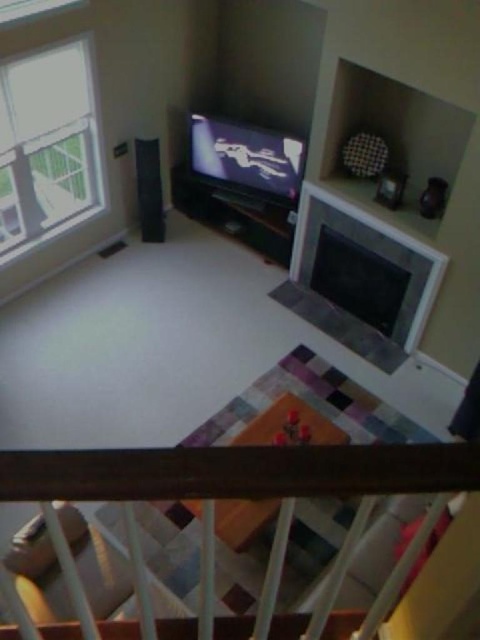
Identify the location of clear glass window at upper left. This screenshot has height=640, width=480. (48, 147).

Is point (46, 195) behind point (295, 204)?

No, it is not.

Between point (46, 65) and point (238, 184), which one is positioned behind?

Point (238, 184)

Identify the location of clear glass window at upper left. The image size is (480, 640). (48, 147).

Based on the photo, does brown wooden rail at upper center have a larger size compared to clear glass window at upper left?

No, brown wooden rail at upper center is not bigger than clear glass window at upper left.

Between point (409, 566) and point (83, 204), which one is positioned behind?

The point (83, 204) is more distant.

The height and width of the screenshot is (640, 480). I want to click on brown wooden rail at upper center, so click(244, 490).

Does brown wooden rail at upper center appear on the left side of matte black flat screen tv at center?

Correct, you'll find brown wooden rail at upper center to the left of matte black flat screen tv at center.

Between point (74, 600) and point (282, 196), which one is positioned in front?

Point (74, 600) is more forward.

Measure the distance between point (115, 468) and camera.

The distance of point (115, 468) from camera is 88.07 centimeters.

The height and width of the screenshot is (640, 480). I want to click on brown wooden rail at upper center, so click(x=244, y=490).